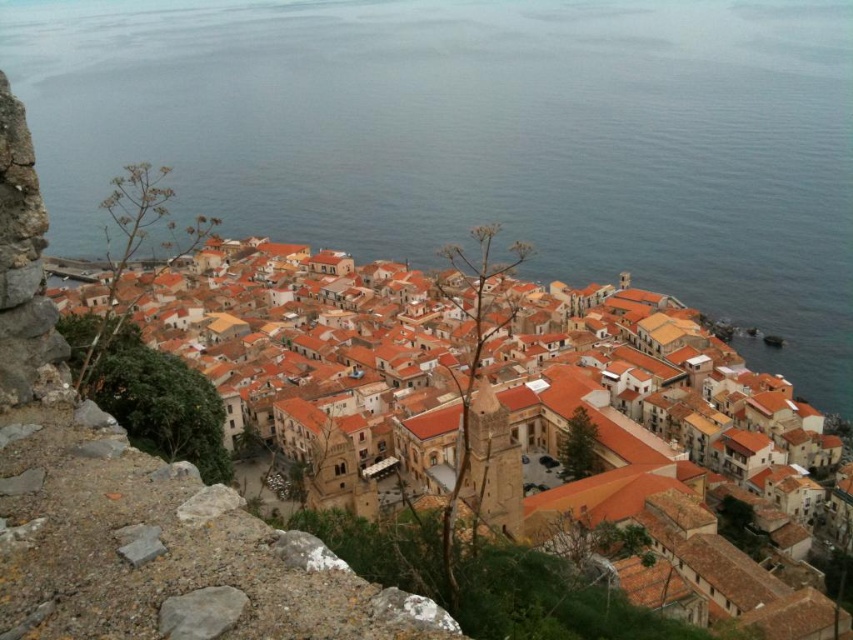
Who is shorter, blue water at center or orange clay buildings at center?

With less height is orange clay buildings at center.

Does point (55, 88) come farther from viewer compared to point (735, 564)?

Yes, it is behind point (735, 564).

Find the location of `blue water at center`. blue water at center is located at coordinates (480, 138).